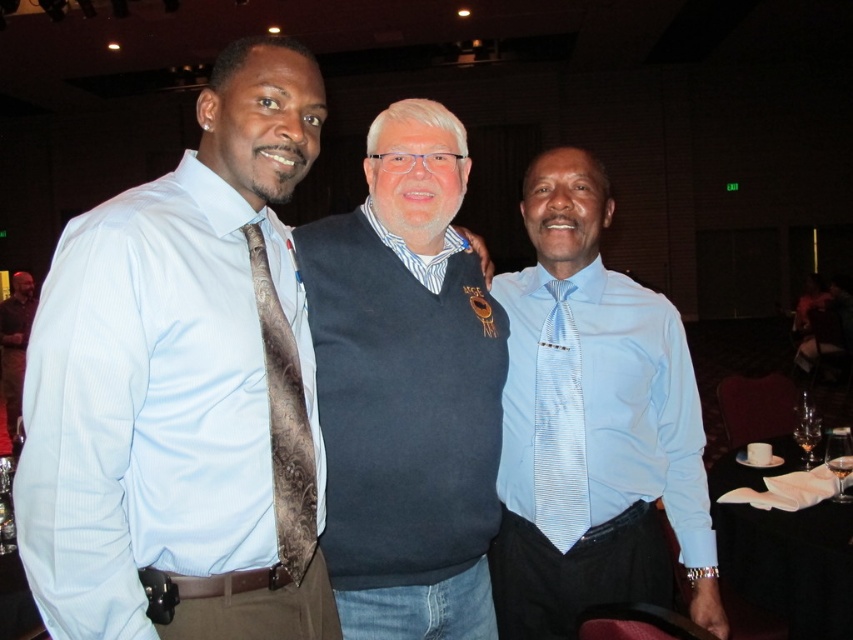
Is light blue striped tie at center thinner than brown leather jacket at left?

Indeed, light blue striped tie at center has a lesser width compared to brown leather jacket at left.

Is point (558, 484) closer to viewer compared to point (22, 378)?

Yes.

I want to click on light blue striped tie at center, so [560, 426].

I want to click on light blue striped tie at center, so 560,426.

Can you confirm if black fabric table at lower right is positioned to the left of striped cotton shirt at center?

In fact, black fabric table at lower right is to the right of striped cotton shirt at center.

Does black fabric table at lower right lie in front of striped cotton shirt at center?

No.

Is point (722, 536) positioned behind point (374, 214)?

That is True.

Identify the location of black fabric table at lower right. This screenshot has height=640, width=853. (784, 548).

Between brown paisley tie at left and light blue striped tie at center, which one is positioned higher?

brown paisley tie at left

Based on the photo, does brown paisley tie at left appear under light blue striped tie at center?

Actually, brown paisley tie at left is above light blue striped tie at center.

Between point (276, 320) and point (556, 545), which one is positioned in front?

Point (276, 320) is in front.

You are a GUI agent. You are given a task and a screenshot of the screen. Output one action in this format:
    pyautogui.click(x=<x>, y=<y>)
    Task: Click on the brown paisley tie at left
    This screenshot has height=640, width=853.
    Given the screenshot: What is the action you would take?
    pyautogui.click(x=283, y=420)